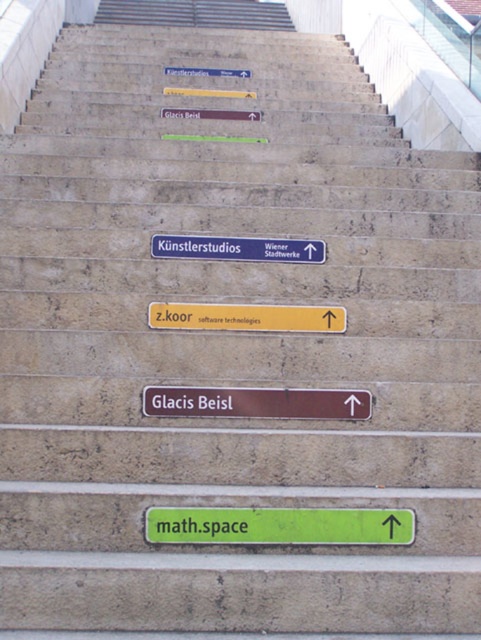
Question: Is brown matte sign at center wider than blue plastic sign at center?

Choices:
 (A) no
 (B) yes

Answer: (A)

Question: Which of these objects is positioned closest to the blue plastic sign at center?

Choices:
 (A) matte blue sign at upper center
 (B) yellow matte sign at center
 (C) brown matte sign at center
 (D) matte brown sign at center

Answer: (B)

Question: Is yellow matte sign at center further to camera compared to blue plastic sign at center?

Choices:
 (A) yes
 (B) no

Answer: (B)

Question: Which of the following is the farthest from the observer?

Choices:
 (A) (300, 413)
 (B) (192, 512)
 (C) (215, 328)

Answer: (C)

Question: Which point is farther to the camera?

Choices:
 (A) yellow matte sign at center
 (B) matte brown sign at center
 (C) matte blue sign at upper center
 (D) brown matte sign at center

Answer: (C)

Question: Is yellow matte sign at center thinner than matte brown sign at center?

Choices:
 (A) no
 (B) yes

Answer: (B)